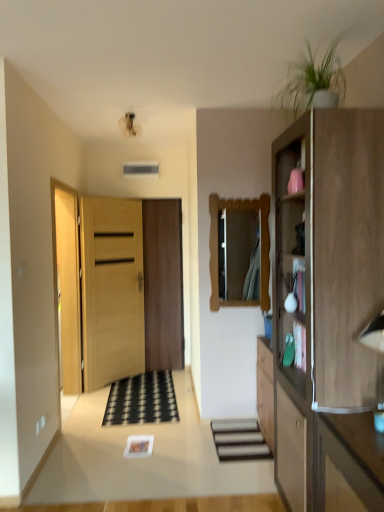
What are the coordinates of `wooden door at center, placed as the 1th door when sorted from back to front` in the screenshot? It's located at (163, 284).

This screenshot has height=512, width=384. I want to click on green matte plant at upper right, so click(x=313, y=81).

Based on the photo, measure the distance between wooden mirror at center and camera.

The distance of wooden mirror at center from camera is 11.58 feet.

At what (x,y) coordinates should I click in order to perform the action: click on smooth wooden stairs at center. Please return your answer as a coordinate pair (x, y). Looking at the image, I should click on (239, 440).

Is wooden mirror at center thinner than green matte plant at upper right?

Indeed, wooden mirror at center has a lesser width compared to green matte plant at upper right.

Is wooden mirror at center positioned behind green matte plant at upper right?

Yes, wooden mirror at center is further from the viewer.

Considering the sizes of objects wooden mirror at center and green matte plant at upper right in the image provided, who is smaller, wooden mirror at center or green matte plant at upper right?

Smaller between the two is wooden mirror at center.

From their relative heights in the image, would you say wooden mirror at center is taller or shorter than green matte plant at upper right?

In the image, wooden mirror at center appears to be taller than green matte plant at upper right.

Which door is the 1st one when counting from the back of the smooth wooden stairs at center? Please provide its 2D coordinates.

[(111, 290)]

Are smooth wooden stairs at center and wooden door at center, arranged as the 2th door when viewed from the back, located far from each other?

Yes, smooth wooden stairs at center is far from wooden door at center, arranged as the 2th door when viewed from the back.

Is point (253, 426) farther from camera compared to point (110, 224)?

That is False.

Between smooth wooden stairs at center and wooden door at center, acting as the 1th door starting from the front, which one is positioned behind?

wooden door at center, acting as the 1th door starting from the front.

From the image's perspective, is wooden door at center, placed as the 1th door when sorted from back to front, on green matte plant at upper right?

No, from the image's perspective, wooden door at center, placed as the 1th door when sorted from back to front, is not on top of green matte plant at upper right.

Which of these two, wooden door at center, the second door from the front, or green matte plant at upper right, is smaller?

green matte plant at upper right is smaller.

Looking at their sizes, would you say wooden door at center, placed as the 1th door when sorted from back to front, is wider or thinner than green matte plant at upper right?

Clearly, wooden door at center, placed as the 1th door when sorted from back to front, has less width compared to green matte plant at upper right.

From a real-world perspective, is wooden door at center, the second door from the front, below green matte plant at upper right?

Yes, from a real-world perspective, wooden door at center, the second door from the front, is beneath green matte plant at upper right.

Where is `stairwell that is under the wooden door at center, arranged as the 2th door when viewed from the back (from a real-world perspective)`? This screenshot has height=512, width=384. stairwell that is under the wooden door at center, arranged as the 2th door when viewed from the back (from a real-world perspective) is located at coordinates (239, 440).

Is point (121, 221) positioned after point (244, 450)?

Yes.

From a real-world perspective, is wooden door at center, arranged as the 2th door when viewed from the back, under smooth wooden stairs at center?

No, from a real-world perspective, wooden door at center, arranged as the 2th door when viewed from the back, is not under smooth wooden stairs at center.

In the scene shown: From the image's perspective, relative to smooth wooden stairs at center, is wooden door at center, acting as the 1th door starting from the front, above or below?

wooden door at center, acting as the 1th door starting from the front, is above smooth wooden stairs at center.

Could smooth wooden stairs at center be considered to be inside wooden door at center, the second door from the front?

No, wooden door at center, the second door from the front, does not contain smooth wooden stairs at center.

What's the angular difference between wooden door at center, the second door from the front, and smooth wooden stairs at center's facing directions?

There is a 89.6-degree angle between the facing directions of wooden door at center, the second door from the front, and smooth wooden stairs at center.

In the image, is wooden door at center, the second door from the front, positioned in front of or behind smooth wooden stairs at center?

Visually, wooden door at center, the second door from the front, is located behind smooth wooden stairs at center.

In terms of width, does wooden door at center, placed as the 1th door when sorted from back to front, look wider or thinner when compared to smooth wooden stairs at center?

wooden door at center, placed as the 1th door when sorted from back to front, is thinner than smooth wooden stairs at center.

From the image's perspective, is smooth wooden stairs at center under wooden door at center, placed as the 1th door when sorted from back to front?

Yes, from the image's perspective, smooth wooden stairs at center is beneath wooden door at center, placed as the 1th door when sorted from back to front.

From a real-world perspective, is smooth wooden stairs at center over wooden door at center, placed as the 1th door when sorted from back to front?

Incorrect, from a real-world perspective, smooth wooden stairs at center is lower than wooden door at center, placed as the 1th door when sorted from back to front.

This screenshot has width=384, height=512. Identify the location of stairwell below the wooden door at center, the second door from the front (from the image's perspective). (239, 440).

Is point (242, 425) less distant than point (145, 271)?

Yes, it is.

Is black rubber doormat at center taller than wooden door at center, acting as the 1th door starting from the front?

No.

From the image's perspective, is black rubber doormat at center on top of wooden door at center, acting as the 1th door starting from the front?

Actually, black rubber doormat at center appears below wooden door at center, acting as the 1th door starting from the front, in the image.

Which is in front, point (144, 421) or point (119, 248)?

The point (144, 421) is in front.

At what (x,y) coordinates should I click in order to perform the action: click on mirror located below the green matte plant at upper right (from the image's perspective). Please return your answer as a coordinate pair (x, y). The width and height of the screenshot is (384, 512). Looking at the image, I should click on (261, 242).

Identify the location of door that is the 1st object located behind the smooth wooden stairs at center. (111, 290).

From the image, which object appears to be nearer to black rubber doormat at center, smooth wooden stairs at center or green matte plant at upper right?

smooth wooden stairs at center is positioned closer to the anchor black rubber doormat at center.

From the picture: Estimate the real-world distances between objects in this image. Which object is further from black rubber doormat at center, wooden door at center, the second door from the front, or smooth wooden stairs at center?

The object further to black rubber doormat at center is wooden door at center, the second door from the front.

Looking at the image, which one is located further to wooden door at center, acting as the 1th door starting from the front, black rubber doormat at center or smooth wooden stairs at center?

Among the two, smooth wooden stairs at center is located further to wooden door at center, acting as the 1th door starting from the front.

Which object lies nearer to the anchor point wooden door at center, acting as the 1th door starting from the front, light brown wood cabinet at right or green matte plant at upper right?

Based on the image, light brown wood cabinet at right appears to be nearer to wooden door at center, acting as the 1th door starting from the front.

Looking at the image, which one is located closer to wooden mirror at center, green matte plant at upper right or wooden door at center, acting as the 1th door starting from the front?

green matte plant at upper right is positioned closer to the anchor wooden mirror at center.

Based on their spatial positions, is wooden door at center, arranged as the 2th door when viewed from the back, or black rubber doormat at center closer to wooden door at center, the second door from the front?

wooden door at center, arranged as the 2th door when viewed from the back.

When comparing their distances from light brown wood cabinet at right, does smooth wooden stairs at center or wooden door at center, placed as the 1th door when sorted from back to front, seem closer?

smooth wooden stairs at center.

Looking at the image, which one is located closer to wooden door at center, the second door from the front, wooden door at center, arranged as the 2th door when viewed from the back, or light brown wood cabinet at right?

Among the two, wooden door at center, arranged as the 2th door when viewed from the back, is located nearer to wooden door at center, the second door from the front.

At what (x,y) coordinates should I click in order to perform the action: click on doormat positioned between smooth wooden stairs at center and wooden door at center, placed as the 1th door when sorted from back to front, from near to far. Please return your answer as a coordinate pair (x, y). This screenshot has height=512, width=384. Looking at the image, I should click on (142, 400).

Image resolution: width=384 pixels, height=512 pixels. Identify the location of doormat between wooden mirror at center and smooth wooden stairs at center in the up-down direction. (142, 400).

The height and width of the screenshot is (512, 384). I want to click on stairwell between light brown wood cabinet at right and wooden mirror at center in the front-back direction, so click(x=239, y=440).

You are a GUI agent. You are given a task and a screenshot of the screen. Output one action in this format:
    pyautogui.click(x=<x>, y=<y>)
    Task: Click on the stairwell between green matte plant at upper right and wooden door at center, placed as the 1th door when sorted from back to front, in the front-back direction
    
    Given the screenshot: What is the action you would take?
    pyautogui.click(x=239, y=440)